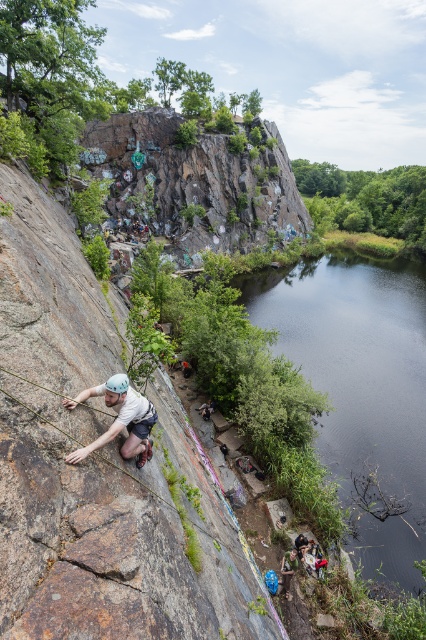
You are a hiker planning to cross the area where the brown rough rock at left and blue rubber boots at lower center are located. Which object should you avoid stepping on to ensure stability?

The brown rough rock at left is larger in size than the blue rubber boots at lower center, so stepping on the brown rough rock at left would provide better stability.

You are a photographer positioned at the bottom of the cliff, looking up at the climber. Where is the matte white helmet at left located in relation to the climber?

The matte white helmet at left is located at point 0.655 on the x axis and 0.279 on the y axis relative to the climber.

You are a photographer positioned at the base of the cliff. You want to capture a photo of the climber. Which object, the matte white helmet at left or the blue rubber boots at lower center, should you focus on first to ensure the climber is fully in the frame?

The matte white helmet at left is located above the blue rubber boots at lower center, so you should focus on the matte white helmet at left first to ensure the climber is fully in the frame.